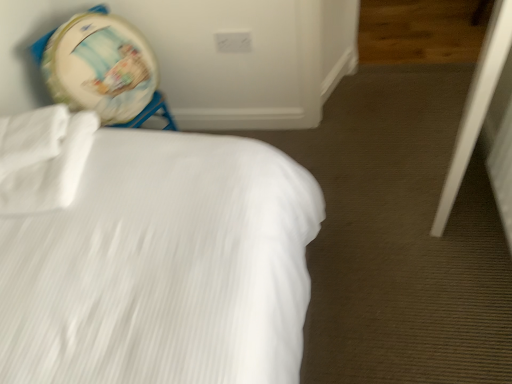
Image resolution: width=512 pixels, height=384 pixels. I want to click on free space to the back side of white plastic screen door at lower right, so click(x=402, y=125).